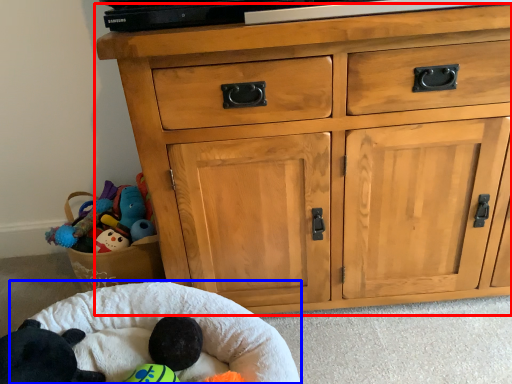
Question: Which object appears closest to the camera in this image, chest of drawers (highlighted by a red box) or infant bed (highlighted by a blue box)?

Choices:
 (A) chest of drawers
 (B) infant bed

Answer: (B)